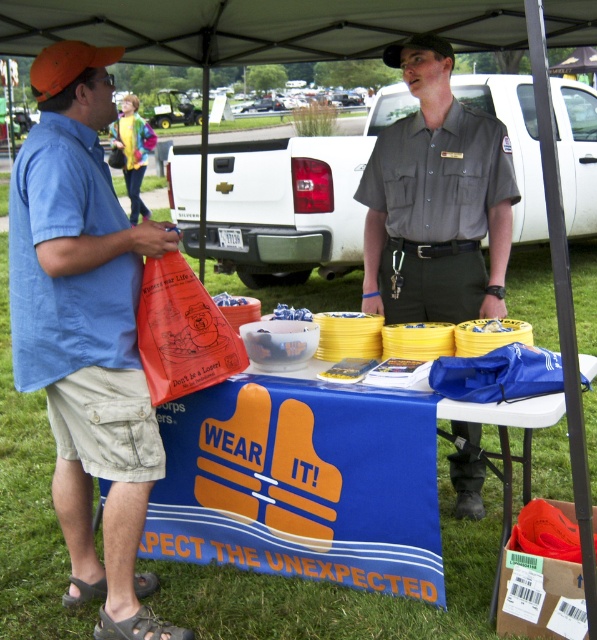
You are organizing an event and need to know which item takes up more space on the table. Which one is larger between the orange fabric bag at left and the white fabric canopy at upper center?

The white fabric canopy at upper center occupies more space than the orange fabric bag at left.

Consider the image. You are a participant at the event and want to grab the orange fabric baseball cap at upper left. Can you reach it from your position at the blue fabric table at center?

The blue fabric table at center is in front of the orange fabric baseball cap at upper left, meaning the cap is behind the table. Since you are at the table, you might not be able to reach the cap unless you move around the table.

You are organizing an event and need to place an item that is 1 meter wide on the table. Given the orange fabric bag at left and the white fabric canopy at upper center, which object can accommodate the item based on their widths?

The white fabric canopy at upper center has a greater width than the orange fabric bag at left, so the item can be placed under the white fabric canopy at upper center.